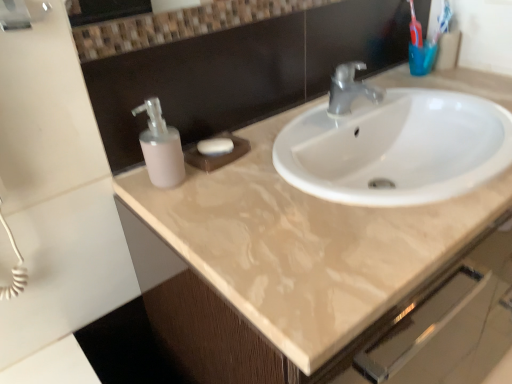
Question: Should I look upward or downward to see matte plastic soap dispenser at left?

Choices:
 (A) down
 (B) up

Answer: (B)

Question: Considering the relative sizes of beige glossy sink at upper center and matte plastic soap dispenser at left in the image provided, is beige glossy sink at upper center thinner than matte plastic soap dispenser at left?

Choices:
 (A) yes
 (B) no

Answer: (B)

Question: Is beige glossy sink at upper center in front of matte plastic soap dispenser at left?

Choices:
 (A) no
 (B) yes

Answer: (B)

Question: From the image's perspective, is beige glossy sink at upper center on top of matte plastic soap dispenser at left?

Choices:
 (A) yes
 (B) no

Answer: (B)

Question: From a real-world perspective, is beige glossy sink at upper center physically above matte plastic soap dispenser at left?

Choices:
 (A) no
 (B) yes

Answer: (A)

Question: Is matte plastic soap dispenser at left a part of beige glossy sink at upper center?

Choices:
 (A) no
 (B) yes

Answer: (A)

Question: Does beige glossy sink at upper center have a smaller size compared to matte plastic soap dispenser at left?

Choices:
 (A) no
 (B) yes

Answer: (A)

Question: Is blue plastic toothbrush at upper right oriented towards white matte soap at center?

Choices:
 (A) no
 (B) yes

Answer: (A)

Question: Is blue plastic toothbrush at upper right located outside white matte soap at center?

Choices:
 (A) yes
 (B) no

Answer: (A)

Question: From a real-world perspective, does blue plastic toothbrush at upper right sit lower than white matte soap at center?

Choices:
 (A) no
 (B) yes

Answer: (A)

Question: Is blue plastic toothbrush at upper right thinner than white matte soap at center?

Choices:
 (A) yes
 (B) no

Answer: (A)

Question: Considering the relative positions of blue plastic toothbrush at upper right and white matte soap at center in the image provided, is blue plastic toothbrush at upper right to the left of white matte soap at center from the viewer's perspective?

Choices:
 (A) yes
 (B) no

Answer: (B)

Question: Considering the relative sizes of blue plastic toothbrush at upper right and white matte soap at center in the image provided, is blue plastic toothbrush at upper right taller than white matte soap at center?

Choices:
 (A) yes
 (B) no

Answer: (A)

Question: Would you say blue plastic toothbrush at upper right is outside matte plastic soap dispenser at left?

Choices:
 (A) no
 (B) yes

Answer: (B)